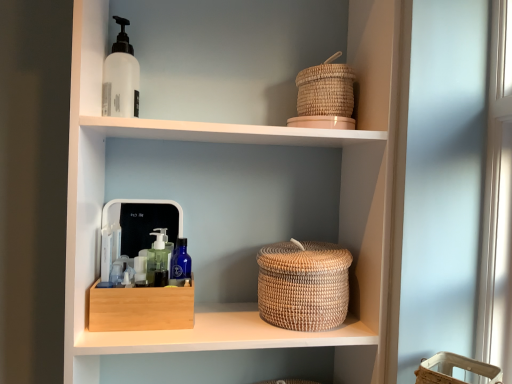
Question: Does woven natural basket at center have a lesser width compared to white matte bottle at upper left?

Choices:
 (A) no
 (B) yes

Answer: (A)

Question: Is woven natural basket at center to the right of white matte bottle at upper left from the viewer's perspective?

Choices:
 (A) yes
 (B) no

Answer: (A)

Question: Considering the relative sizes of woven natural basket at center and white matte bottle at upper left in the image provided, is woven natural basket at center shorter than white matte bottle at upper left?

Choices:
 (A) yes
 (B) no

Answer: (A)

Question: From the image's perspective, would you say woven natural basket at center is positioned over white matte bottle at upper left?

Choices:
 (A) no
 (B) yes

Answer: (A)

Question: From the image's perspective, would you say woven natural basket at center is shown under white matte bottle at upper left?

Choices:
 (A) no
 (B) yes

Answer: (B)

Question: Does woven natural basket at center have a smaller size compared to white matte bottle at upper left?

Choices:
 (A) yes
 (B) no

Answer: (B)

Question: From a real-world perspective, does woven beige basket at lower right, which is the first basket in right-to-left order, sit lower than woven natural basket at center?

Choices:
 (A) yes
 (B) no

Answer: (A)

Question: Can you confirm if woven beige basket at lower right, the 2th basket positioned from the left, is taller than woven natural basket at center?

Choices:
 (A) yes
 (B) no

Answer: (A)

Question: Could you tell me if woven beige basket at lower right, which is the first basket in right-to-left order, is facing woven natural basket at center?

Choices:
 (A) yes
 (B) no

Answer: (B)

Question: Is woven beige basket at lower right, which appears as the first basket when viewed from the front, located outside woven natural basket at center?

Choices:
 (A) no
 (B) yes

Answer: (B)

Question: From the image's perspective, is woven beige basket at lower right, positioned as the 1th basket in bottom-to-top order, on woven natural basket at center?

Choices:
 (A) no
 (B) yes

Answer: (A)

Question: Is woven beige basket at lower right, positioned as the 1th basket in bottom-to-top order, shorter than woven natural basket at center?

Choices:
 (A) no
 (B) yes

Answer: (A)

Question: From the image's perspective, would you say white matte bottle at upper left is shown under natural woven basket at upper right?

Choices:
 (A) yes
 (B) no

Answer: (B)